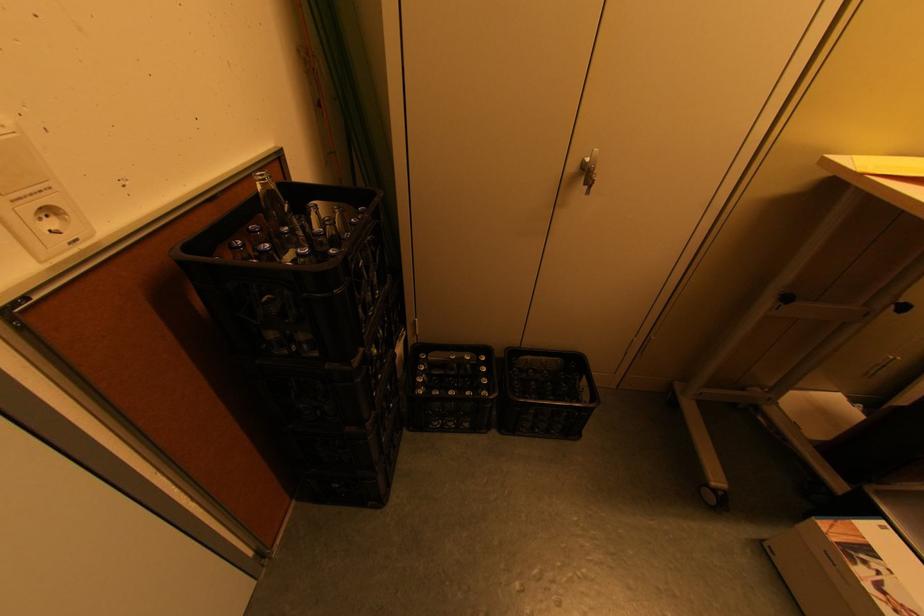
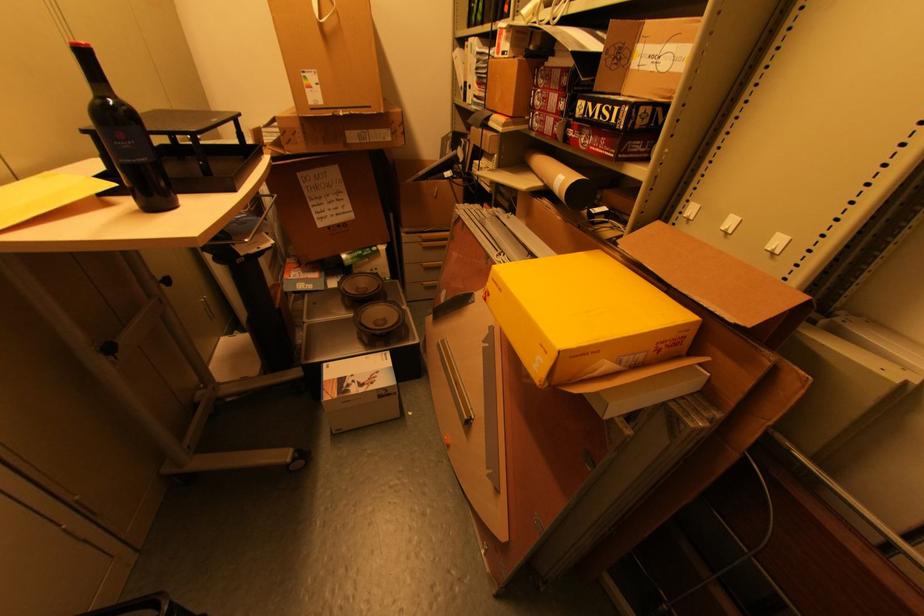
Question: I am providing you with two images of the same scene from different viewpoints. Which of the following objects are not visible in image2?

Choices:
 (A) ASUS cardboard box
 (B) cardboard tube
 (C) bag handle
 (D) none of these

Answer: (D)